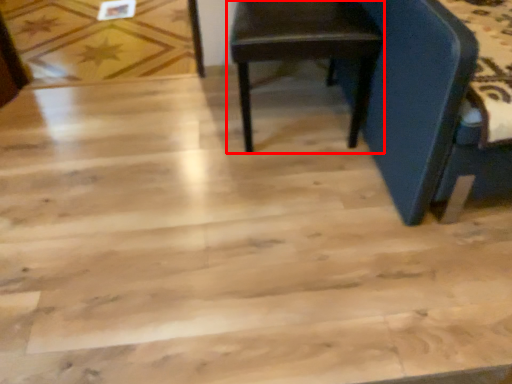
Question: Observing the image, what is the correct spatial positioning of chair (annotated by the red box) in reference to plywood?

Choices:
 (A) left
 (B) right

Answer: (B)